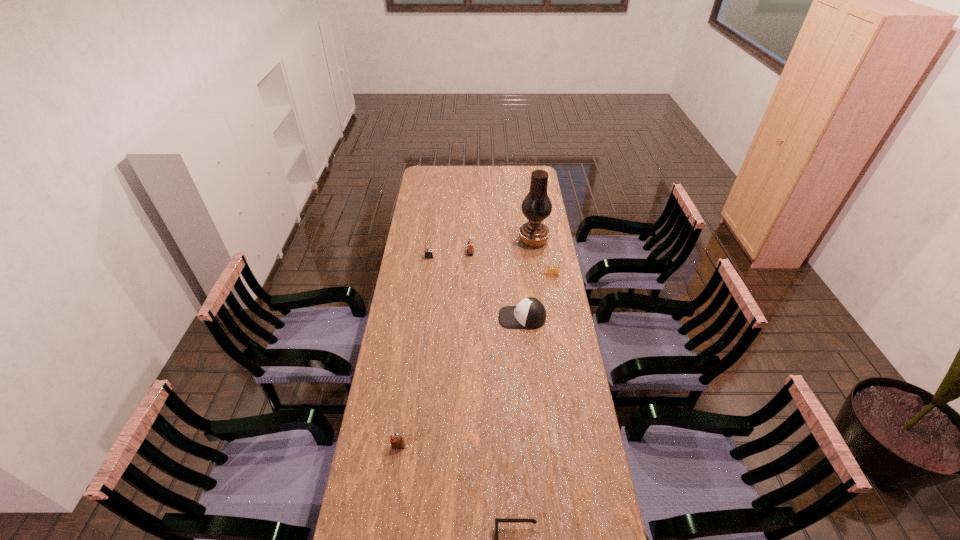
At what (x,y) coordinates should I click in order to perform the action: click on oil lamp. Please return your answer as a coordinate pair (x, y). Image resolution: width=960 pixels, height=540 pixels. Looking at the image, I should click on (536, 206).

The image size is (960, 540). I want to click on the third object from left to right, so click(x=470, y=251).

Where is `the fourth nearest object`? the fourth nearest object is located at coordinates (551, 270).

Where is `the rightmost padlock`? This screenshot has height=540, width=960. the rightmost padlock is located at coordinates (551, 270).

Locate an element on the screen. This screenshot has width=960, height=540. cap is located at coordinates (529, 313).

Locate an element on the screen. Image resolution: width=960 pixels, height=540 pixels. the sixth farthest object is located at coordinates (396, 442).

Locate an element on the screen. The image size is (960, 540). the nearest padlock is located at coordinates (396, 442).

Where is `free space located 0.050m on the left of the oil lamp`? The width and height of the screenshot is (960, 540). free space located 0.050m on the left of the oil lamp is located at coordinates (508, 241).

Identify the location of vacant space located on the front of the fifth object from right to left. The width and height of the screenshot is (960, 540). (469, 293).

In order to click on vacant space located on the front-facing side of the fourth nearest object in this screenshot , I will do `click(565, 345)`.